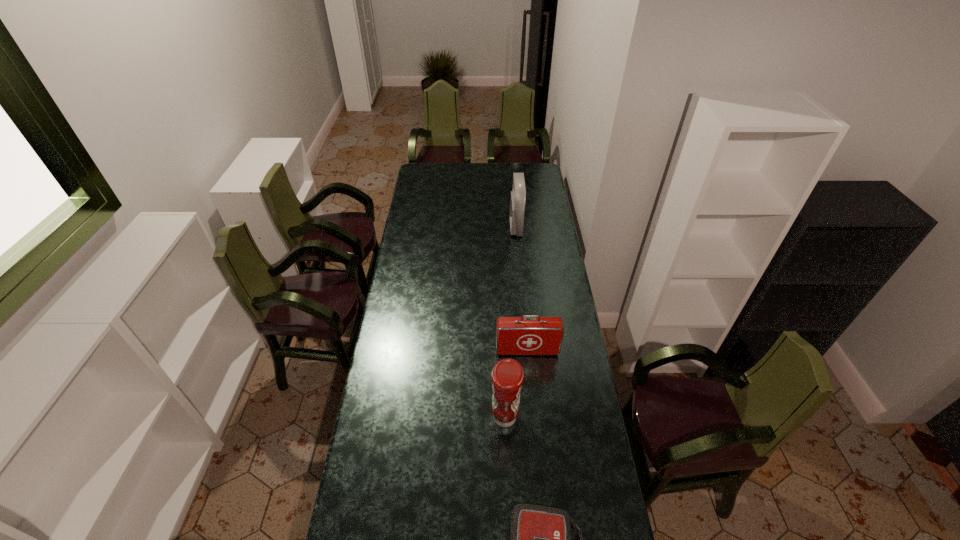
Locate an element on the screen. This screenshot has height=540, width=960. the farthest object is located at coordinates point(518,196).

At what (x,y) coordinates should I click in order to perform the action: click on the tallest first-aid kit. Please return your answer as a coordinate pair (x, y). The height and width of the screenshot is (540, 960). Looking at the image, I should click on (518, 196).

Image resolution: width=960 pixels, height=540 pixels. Find the location of `condiment`. condiment is located at coordinates (507, 376).

You are a GUI agent. You are given a task and a screenshot of the screen. Output one action in this format:
    pyautogui.click(x=<x>, y=<y>)
    Task: Click on the second nearest first-aid kit
    
    Given the screenshot: What is the action you would take?
    pyautogui.click(x=522, y=335)

The height and width of the screenshot is (540, 960). I want to click on the second shortest first-aid kit, so (x=522, y=335).

Where is `vacant point located on the front-facing side of the tallest first-aid kit`? Image resolution: width=960 pixels, height=540 pixels. vacant point located on the front-facing side of the tallest first-aid kit is located at coordinates point(492,227).

Identify the location of vacant region located 0.090m on the front-facing side of the tallest first-aid kit. This screenshot has width=960, height=540. pyautogui.click(x=493, y=227).

Identify the location of vacant region located 0.230m on the front-facing side of the tallest first-aid kit. This screenshot has width=960, height=540. (468, 227).

At what (x,y) coordinates should I click in order to perform the action: click on free space located on the back of the condiment. Please return your answer as a coordinate pair (x, y). Image resolution: width=960 pixels, height=540 pixels. Looking at the image, I should click on (503, 379).

You are a GUI agent. You are given a task and a screenshot of the screen. Output one action in this format:
    pyautogui.click(x=<x>, y=<y>)
    Task: Click on the vacant position located 0.130m on the side of the second shortest object with the first aid cross symbol
    
    Given the screenshot: What is the action you would take?
    pyautogui.click(x=530, y=384)